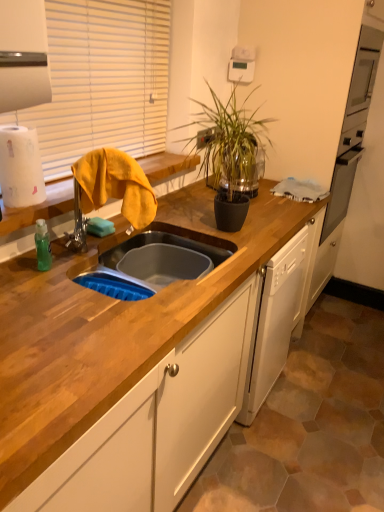
This screenshot has width=384, height=512. Identify the location of free spot to the left of green glossy plant at center. (178, 211).